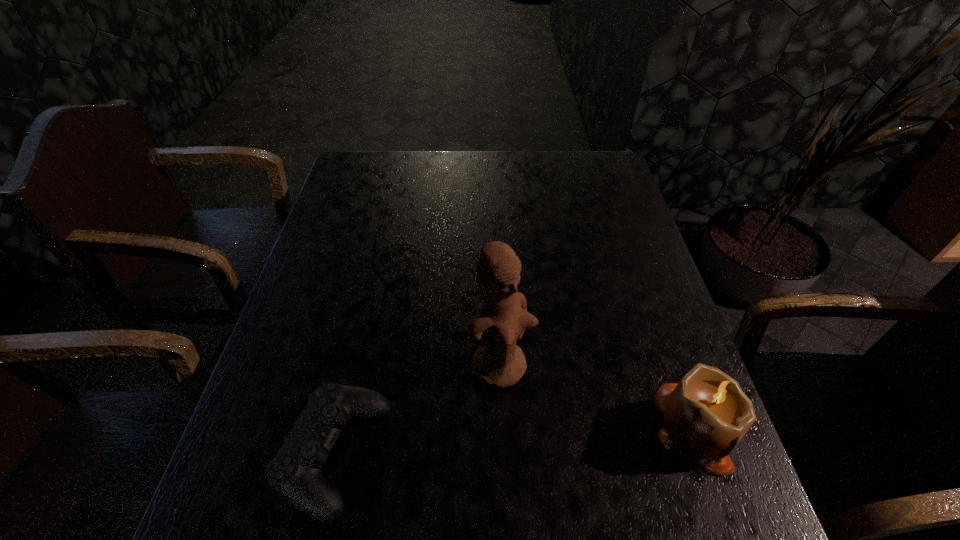
This screenshot has height=540, width=960. What are the coordinates of `vacant space positioned on the front-facing side of the farthest object` in the screenshot? It's located at (451, 360).

Find the location of a particular element. Image resolution: width=960 pixels, height=540 pixels. free region located 0.360m on the front-facing side of the farthest object is located at coordinates (488, 397).

Find the location of a particular element. This screenshot has height=540, width=960. vacant space located on the front-facing side of the second object from right to left is located at coordinates (588, 454).

The image size is (960, 540). What are the coordinates of `vacant region located on the front-facing side of the second object from right to left` in the screenshot? It's located at (561, 426).

You are a GUI agent. You are given a task and a screenshot of the screen. Output one action in this format:
    pyautogui.click(x=<x>, y=<y>)
    Task: Click on the vacant space located 0.050m on the front-facing side of the second object from right to left
    
    Given the screenshot: What is the action you would take?
    pyautogui.click(x=539, y=404)

Where is `control located in the near edge section of the desktop`? control located in the near edge section of the desktop is located at coordinates (294, 473).

At what (x,y) coordinates should I click in order to perform the action: click on candle situated at the near edge. Please return your answer as a coordinate pair (x, y). The height and width of the screenshot is (540, 960). Looking at the image, I should click on (706, 414).

Locate an element on the screen. control located in the left edge section of the desktop is located at coordinates (294, 473).

Where is `spectacles situated at the left edge`? Image resolution: width=960 pixels, height=540 pixels. spectacles situated at the left edge is located at coordinates (380, 276).

Locate an element on the screen. This screenshot has width=960, height=540. object located in the right edge section of the desktop is located at coordinates (706, 414).